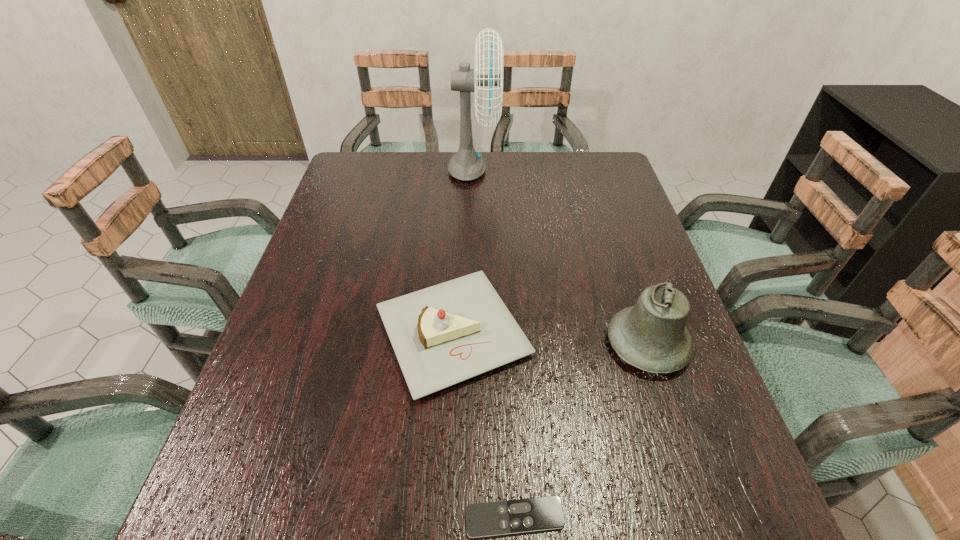
Where is `vacant space positioned 0.170m on the right of the remote control`? vacant space positioned 0.170m on the right of the remote control is located at coordinates (668, 517).

Find the location of a particular element. The height and width of the screenshot is (540, 960). object that is at the far edge is located at coordinates (466, 165).

Find the location of `object situated at the near edge`. object situated at the near edge is located at coordinates (541, 513).

Identify the location of object present at the right edge. (651, 336).

What are the coordinates of `free region at the far edge of the desktop` in the screenshot? It's located at (419, 180).

In order to click on vacant space at the near edge in this screenshot , I will do `click(624, 521)`.

The image size is (960, 540). I want to click on vacant space at the left edge of the desktop, so click(294, 372).

In the image, there is a desktop. At what (x,y) coordinates should I click in order to perform the action: click on vacant space at the right edge. Please return your answer as a coordinate pair (x, y). This screenshot has height=540, width=960. Looking at the image, I should click on (592, 234).

Where is `vacant space at the far left corner`? vacant space at the far left corner is located at coordinates (380, 153).

Find the location of a particular element. The width and height of the screenshot is (960, 540). free space at the far right corner of the desktop is located at coordinates (615, 173).